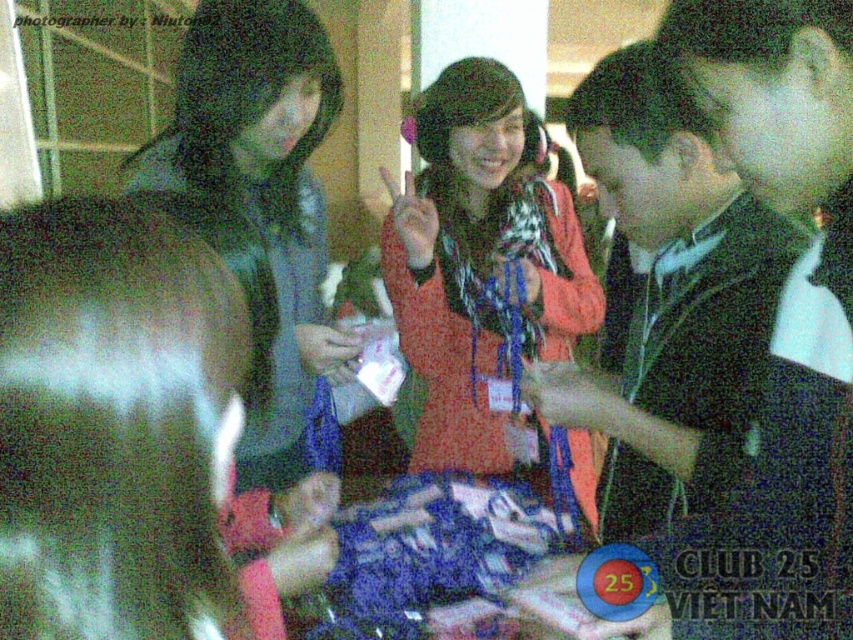
Is black matte jacket at center thinner than green leather jacket at left?

Yes, black matte jacket at center is thinner than green leather jacket at left.

Locate an element on the screen. black matte jacket at center is located at coordinates (668, 298).

Does black matte jacket at center come behind matte orange sweater at center?

No, it is not.

Does black matte jacket at center have a lesser height compared to matte orange sweater at center?

Yes.

Locate an element on the screen. Image resolution: width=853 pixels, height=640 pixels. black matte jacket at center is located at coordinates (668, 298).

Which is more to the right, matte orange sweater at center or green leather jacket at left?

Positioned to the right is matte orange sweater at center.

At what (x,y) coordinates should I click in order to perform the action: click on matte orange sweater at center. Please return your answer as a coordinate pair (x, y). The width and height of the screenshot is (853, 640). Looking at the image, I should click on (480, 272).

Locate an element on the screen. The height and width of the screenshot is (640, 853). matte orange sweater at center is located at coordinates (480, 272).